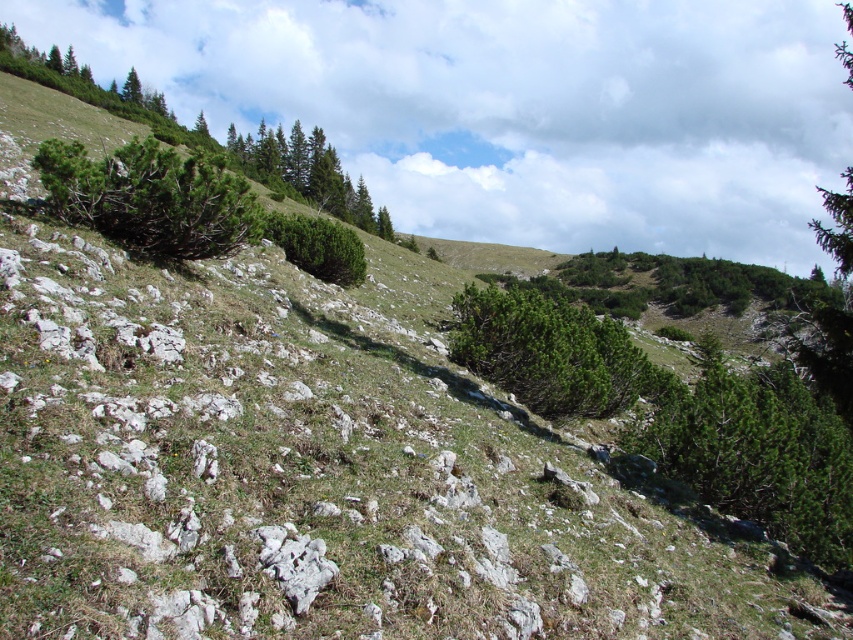
Question: Which object appears farthest from the camera in this image?

Choices:
 (A) green matte tree at center
 (B) green matte tree at upper left

Answer: (B)

Question: Is green matte tree at right to the right of green matte tree at center from the viewer's perspective?

Choices:
 (A) no
 (B) yes

Answer: (B)

Question: Among these points, which one is nearest to the camera?

Choices:
 (A) (62, 176)
 (B) (798, 481)
 (C) (310, 179)
 (D) (457, 332)

Answer: (A)

Question: Does green matte tree at upper center have a larger size compared to green textured pine tree at upper right?

Choices:
 (A) no
 (B) yes

Answer: (A)

Question: From the image, what is the correct spatial relationship of green matte tree at upper center in relation to green matte tree at upper left?

Choices:
 (A) above
 (B) below

Answer: (B)

Question: Among these objects, which one is farthest from the camera?

Choices:
 (A) green matte tree at right
 (B) green matte tree at upper center
 (C) green textured pine tree at upper right
 (D) green matte tree at upper left

Answer: (D)